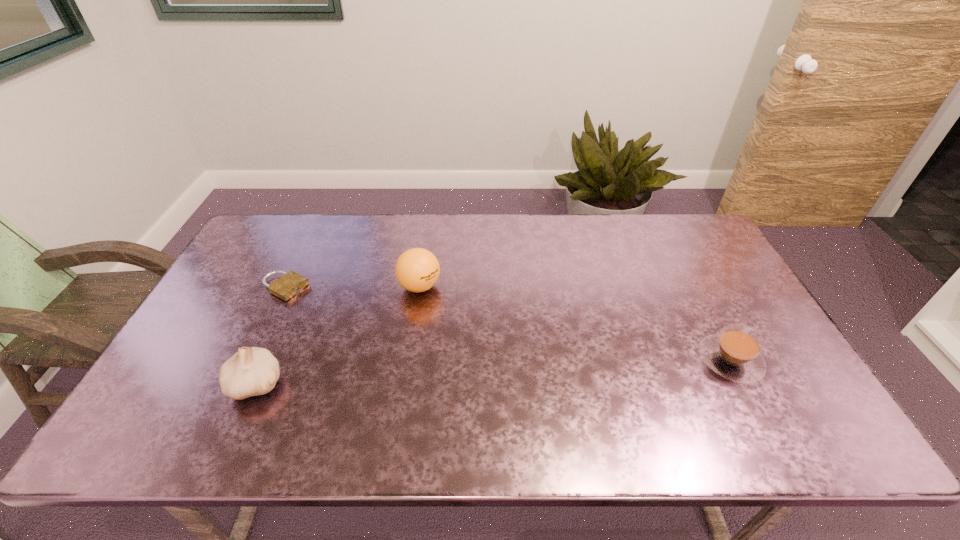
The height and width of the screenshot is (540, 960). In order to click on garlic in this screenshot , I will do tap(251, 371).

The height and width of the screenshot is (540, 960). Identify the location of cappuccino. (735, 354).

Where is `the second shortest object`? This screenshot has width=960, height=540. the second shortest object is located at coordinates (735, 354).

The height and width of the screenshot is (540, 960). Find the location of `the second object from right to left`. the second object from right to left is located at coordinates (417, 270).

Image resolution: width=960 pixels, height=540 pixels. In order to click on padlock in this screenshot , I will do `click(291, 283)`.

Identify the location of free location located 0.070m on the back of the garlic. This screenshot has width=960, height=540. pos(276,340).

The image size is (960, 540). Find the location of `vacant space located on the back of the second shortest object`. vacant space located on the back of the second shortest object is located at coordinates (693, 289).

Identify the location of vacant space located 0.130m on the side with brand of the second object from right to left. This screenshot has width=960, height=540. (444, 330).

Identify the location of blank space located on the side with brand of the second object from right to left. The width and height of the screenshot is (960, 540). (435, 313).

The height and width of the screenshot is (540, 960). I want to click on vacant space situated on the side with brand of the second object from right to left, so click(450, 340).